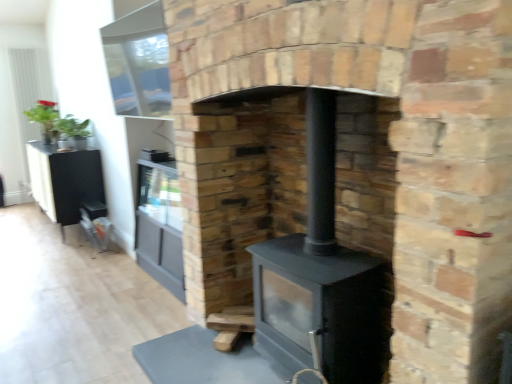
Question: Is black matte wood burning stove at center bigger or smaller than black matte entertainment center at left?

Choices:
 (A) small
 (B) big

Answer: (A)

Question: In the image, is black matte wood burning stove at center positioned in front of or behind black matte entertainment center at left?

Choices:
 (A) front
 (B) behind

Answer: (A)

Question: Which is nearer to the black matte entertainment center at left?

Choices:
 (A) black matte wood burning stove at center
 (B) black matte wood stove at center

Answer: (B)

Question: Which of these objects is positioned closest to the black matte entertainment center at left?

Choices:
 (A) black matte wood stove at center
 (B) black matte wood burning stove at center

Answer: (A)